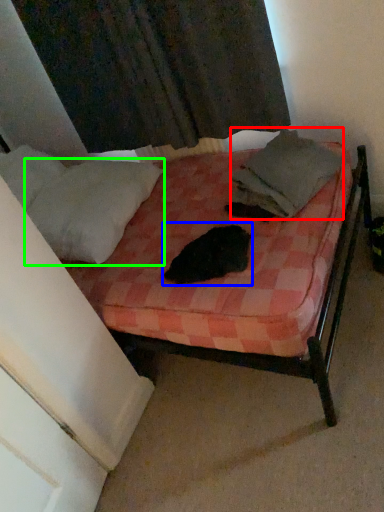
Question: Which object is the closest to the blanket (highlighted by a red box)? Choose among these: animal (highlighted by a blue box) or pillow (highlighted by a green box).

Choices:
 (A) animal
 (B) pillow

Answer: (A)